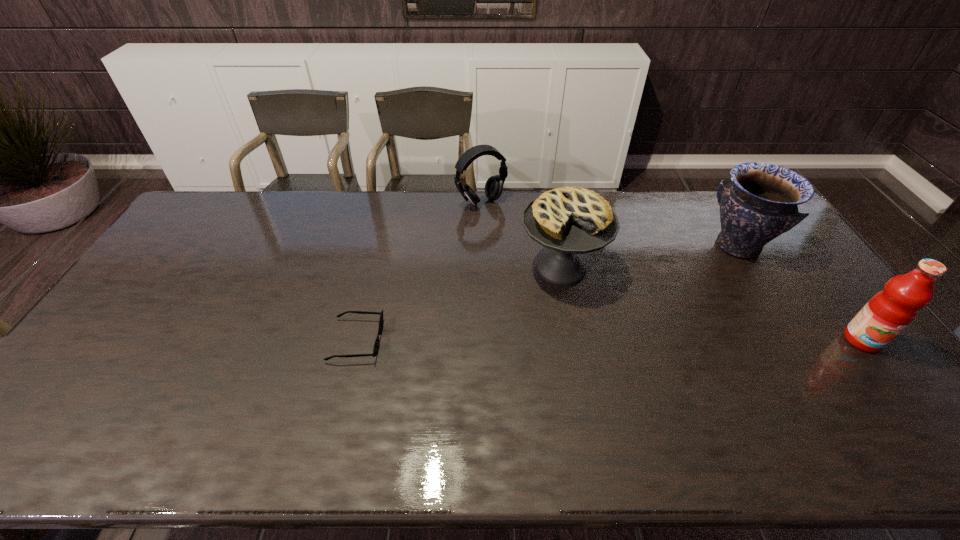
Identify the location of sunglasses. The width and height of the screenshot is (960, 540). (376, 345).

Where is `the leftmost object`? the leftmost object is located at coordinates (376, 345).

Find the location of a particular element. fruit juice is located at coordinates (891, 310).

Identify the location of earphone. (494, 185).

This screenshot has height=540, width=960. Identify the location of the farthest object. (494, 185).

At what (x,y) coordinates should I click in order to perform the action: click on pottery. Please return your answer as a coordinate pair (x, y). The height and width of the screenshot is (540, 960). Looking at the image, I should click on (762, 202).

What are the coordinates of `pie` in the screenshot? It's located at (572, 220).

Identify the location of free location located 0.380m on the front-facing side of the leftmost object. This screenshot has height=540, width=960. (519, 340).

Identify the location of vacant space located 0.060m on the front label of the rightmost object. (888, 374).

Image resolution: width=960 pixels, height=540 pixels. What are the coordinates of `vacant point located on the ear cups of the earphone` in the screenshot? It's located at (514, 233).